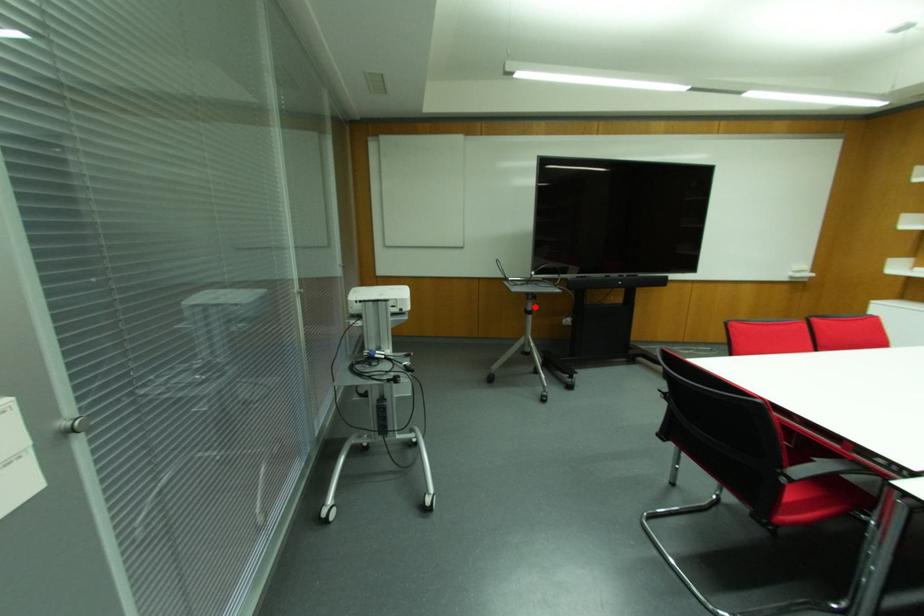
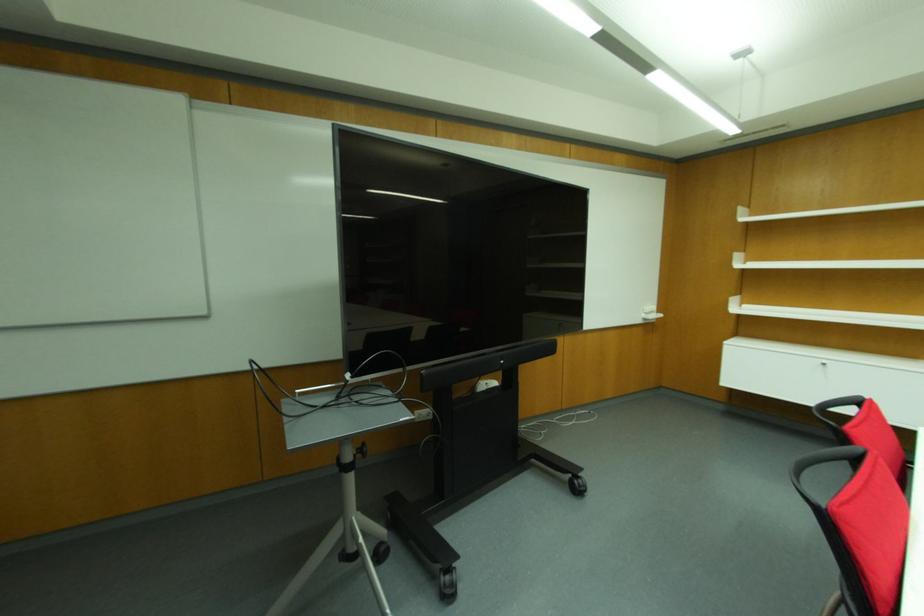
Where in the second image is the point corresponding to the highlighted location from the first image?

(360, 450)